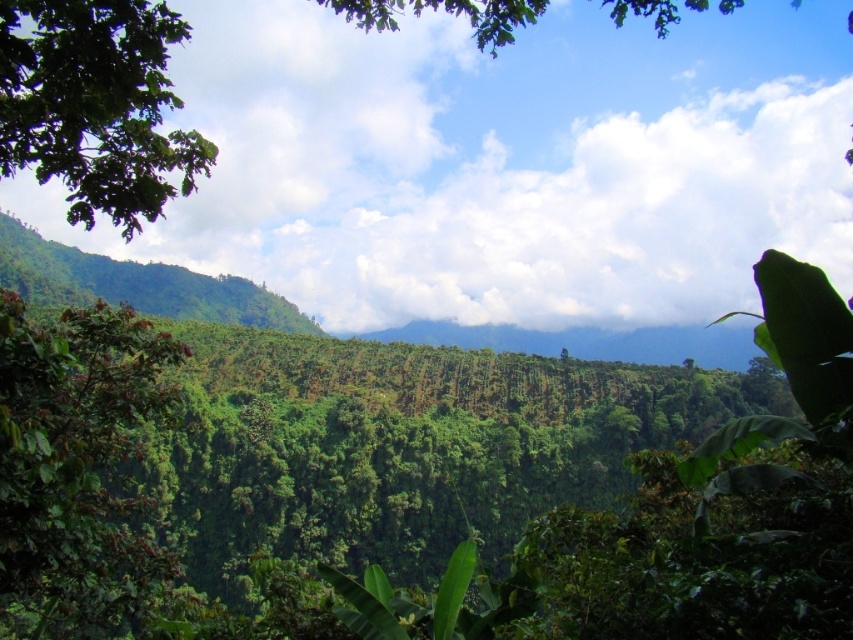
You are a hiker trying to navigate through the dense tropical vegetation. You see two landmarks in the distance, the green leafy tree at left and the green leafy tree at upper left. Which tree would you reach first if you start hiking from the valley below?

The green leafy tree at left is shorter than the green leafy tree at upper left. Since you are starting from the valley below, you would reach the shorter green leafy tree at left first before ascending further to the taller one.

From the picture: You are standing in the lush landscape described. You need to locate the green leafy tree at left. According to the coordinates provided, where exactly is it positioned in the image?

The green leafy tree at left is located at the 2D coordinates point (74, 467) in the image.

You are standing in a lush tropical landscape and see a point marked at coordinates (74, 467). Based on the scene description, where is this point located?

The point is located on a green leafy tree at the left side of the scene.